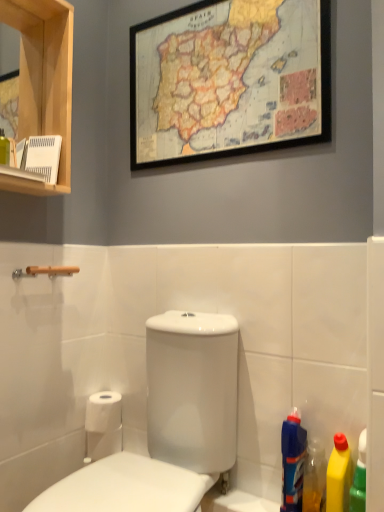
Locate an element on the screen. The image size is (384, 512). white matte toilet paper at lower left is located at coordinates (103, 425).

Image resolution: width=384 pixels, height=512 pixels. Describe the element at coordinates (339, 475) in the screenshot. I see `yellow plastic bottle at lower right, which is counted as the 3th cleaning product, starting from the left` at that location.

What do you see at coordinates (314, 477) in the screenshot? The width and height of the screenshot is (384, 512). I see `translucent plastic bottle at lower right, positioned as the 2th cleaning product in left-to-right order` at bounding box center [314, 477].

Where is `wooden-framed map at upper center`? wooden-framed map at upper center is located at coordinates (229, 80).

From a real-world perspective, is blue plastic bottle at lower right, acting as the 1th cleaning product starting from the left, positioned under yellow plastic bottle at lower right, which is counted as the first cleaning product, starting from the right, based on gravity?

No, from a real-world perspective, blue plastic bottle at lower right, acting as the 1th cleaning product starting from the left, is not under yellow plastic bottle at lower right, which is counted as the first cleaning product, starting from the right.

Is blue plastic bottle at lower right, which ranks as the 3th cleaning product in right-to-left order, far from yellow plastic bottle at lower right, which is counted as the 3th cleaning product, starting from the left?

No, blue plastic bottle at lower right, which ranks as the 3th cleaning product in right-to-left order, is not far away from yellow plastic bottle at lower right, which is counted as the 3th cleaning product, starting from the left.

Is blue plastic bottle at lower right, acting as the 1th cleaning product starting from the left, facing towards yellow plastic bottle at lower right, which is counted as the first cleaning product, starting from the right?

No, blue plastic bottle at lower right, acting as the 1th cleaning product starting from the left, does not turn towards yellow plastic bottle at lower right, which is counted as the first cleaning product, starting from the right.

Would you say blue plastic bottle at lower right, which ranks as the 3th cleaning product in right-to-left order, is inside or outside white glossy toilet at center?

blue plastic bottle at lower right, which ranks as the 3th cleaning product in right-to-left order, is spatially situated outside white glossy toilet at center.

In the scene shown: Considering the sizes of objects blue plastic bottle at lower right, which ranks as the 3th cleaning product in right-to-left order, and white glossy toilet at center in the image provided, who is bigger, blue plastic bottle at lower right, which ranks as the 3th cleaning product in right-to-left order, or white glossy toilet at center?

With larger size is white glossy toilet at center.

From the image's perspective, is blue plastic bottle at lower right, which ranks as the 3th cleaning product in right-to-left order, located above white glossy toilet at center?

No, from the image's perspective, blue plastic bottle at lower right, which ranks as the 3th cleaning product in right-to-left order, is not on top of white glossy toilet at center.

From a real-world perspective, does blue plastic bottle at lower right, acting as the 1th cleaning product starting from the left, sit lower than white glossy toilet at center?

Yes, from a real-world perspective, blue plastic bottle at lower right, acting as the 1th cleaning product starting from the left, is under white glossy toilet at center.

Is yellow plastic bottle at lower right, which is counted as the first cleaning product, starting from the right, shorter than wooden-framed map at upper center?

Correct, yellow plastic bottle at lower right, which is counted as the first cleaning product, starting from the right, is not as tall as wooden-framed map at upper center.

Are yellow plastic bottle at lower right, which is counted as the first cleaning product, starting from the right, and wooden-framed map at upper center making contact?

No, yellow plastic bottle at lower right, which is counted as the first cleaning product, starting from the right, is not in contact with wooden-framed map at upper center.

Consider the image. Is yellow plastic bottle at lower right, which is counted as the 3th cleaning product, starting from the left, not inside wooden-framed map at upper center?

Yes, yellow plastic bottle at lower right, which is counted as the 3th cleaning product, starting from the left, is not within wooden-framed map at upper center.

Is yellow plastic bottle at lower right, which is counted as the 3th cleaning product, starting from the left, looking in the opposite direction of wooden-framed map at upper center?

yellow plastic bottle at lower right, which is counted as the 3th cleaning product, starting from the left, does not have its back to wooden-framed map at upper center.

Considering the positions of objects blue plastic bottle at lower right, acting as the 1th cleaning product starting from the left, and white matte toilet paper at lower left in the image provided, who is behind, blue plastic bottle at lower right, acting as the 1th cleaning product starting from the left, or white matte toilet paper at lower left?

white matte toilet paper at lower left is further away from the camera.

Is blue plastic bottle at lower right, which ranks as the 3th cleaning product in right-to-left order, positioned with its back to white matte toilet paper at lower left?

No, blue plastic bottle at lower right, which ranks as the 3th cleaning product in right-to-left order, is not facing the opposite direction of white matte toilet paper at lower left.

From a real-world perspective, is blue plastic bottle at lower right, acting as the 1th cleaning product starting from the left, physically below white matte toilet paper at lower left?

No.

This screenshot has height=512, width=384. What are the coordinates of `the 3rd cleaning product above when counting from the white matte toilet paper at lower left (from the image's perspective)` in the screenshot? It's located at (292, 462).

Looking at this image, is wooden-framed map at upper center placed right next to white glossy toilet at center?

No, wooden-framed map at upper center is not next to white glossy toilet at center.

Who is smaller, wooden-framed map at upper center or white glossy toilet at center?

With smaller size is wooden-framed map at upper center.

Between point (200, 153) and point (84, 482), which one is positioned behind?

The point (200, 153) is more distant.

From the image's perspective, is white matte toilet paper at lower left above translucent plastic bottle at lower right, positioned as the 2th cleaning product in left-to-right order?

Incorrect, from the image's perspective, white matte toilet paper at lower left is lower than translucent plastic bottle at lower right, positioned as the 2th cleaning product in left-to-right order.

Is white matte toilet paper at lower left wider than translucent plastic bottle at lower right, which appears as the second cleaning product when viewed from the right?

Indeed, white matte toilet paper at lower left has a greater width compared to translucent plastic bottle at lower right, which appears as the second cleaning product when viewed from the right.

Looking at this image, considering the sizes of white matte toilet paper at lower left and translucent plastic bottle at lower right, positioned as the 2th cleaning product in left-to-right order, in the image, is white matte toilet paper at lower left bigger or smaller than translucent plastic bottle at lower right, positioned as the 2th cleaning product in left-to-right order,?

In the image, white matte toilet paper at lower left appears to be larger than translucent plastic bottle at lower right, positioned as the 2th cleaning product in left-to-right order.

Consider the image. Which object is closer to the camera taking this photo, white matte toilet paper at lower left or translucent plastic bottle at lower right, positioned as the 2th cleaning product in left-to-right order?

translucent plastic bottle at lower right, positioned as the 2th cleaning product in left-to-right order, is in front.

Is translucent plastic bottle at lower right, which appears as the second cleaning product when viewed from the right, next to yellow plastic bottle at lower right, which is counted as the first cleaning product, starting from the right?

Yes, translucent plastic bottle at lower right, which appears as the second cleaning product when viewed from the right, is beside yellow plastic bottle at lower right, which is counted as the first cleaning product, starting from the right.

Which is more to the right, translucent plastic bottle at lower right, which appears as the second cleaning product when viewed from the right, or yellow plastic bottle at lower right, which is counted as the 3th cleaning product, starting from the left?

yellow plastic bottle at lower right, which is counted as the 3th cleaning product, starting from the left.

Is yellow plastic bottle at lower right, which is counted as the 3th cleaning product, starting from the left, at the back of translucent plastic bottle at lower right, positioned as the 2th cleaning product in left-to-right order?

No, translucent plastic bottle at lower right, positioned as the 2th cleaning product in left-to-right order, is not facing away from yellow plastic bottle at lower right, which is counted as the 3th cleaning product, starting from the left.

Does translucent plastic bottle at lower right, positioned as the 2th cleaning product in left-to-right order, contain yellow plastic bottle at lower right, which is counted as the 3th cleaning product, starting from the left?

No, translucent plastic bottle at lower right, positioned as the 2th cleaning product in left-to-right order, does not contain yellow plastic bottle at lower right, which is counted as the 3th cleaning product, starting from the left.

Starting from the blue plastic bottle at lower right, which ranks as the 3th cleaning product in right-to-left order, which cleaning product is the 2nd one in front? Please provide its 2D coordinates.

[(339, 475)]

This screenshot has width=384, height=512. Identify the location of the 3rd cleaning product behind the white glossy toilet at center, counting from the anchor's position. (292, 462).

From the picture: Which object lies nearer to the anchor point blue plastic bottle at lower right, which ranks as the 3th cleaning product in right-to-left order, translucent plastic bottle at lower right, positioned as the 2th cleaning product in left-to-right order, or wooden-framed map at upper center?

translucent plastic bottle at lower right, positioned as the 2th cleaning product in left-to-right order, is closer to blue plastic bottle at lower right, which ranks as the 3th cleaning product in right-to-left order.

Based on the photo, from the image, which object appears to be nearer to yellow plastic bottle at lower right, which is counted as the 3th cleaning product, starting from the left, blue plastic bottle at lower right, acting as the 1th cleaning product starting from the left, or white glossy toilet at center?

Among the two, blue plastic bottle at lower right, acting as the 1th cleaning product starting from the left, is located nearer to yellow plastic bottle at lower right, which is counted as the 3th cleaning product, starting from the left.

Considering their positions, is wooden-framed map at upper center positioned closer to white matte toilet paper at lower left than white glossy toilet at center?

The object closer to white matte toilet paper at lower left is white glossy toilet at center.

Looking at the image, which one is located further to translucent plastic bottle at lower right, which appears as the second cleaning product when viewed from the right, white glossy toilet at center or wooden-framed map at upper center?

wooden-framed map at upper center is further to translucent plastic bottle at lower right, which appears as the second cleaning product when viewed from the right.

Considering their positions, is white matte toilet paper at lower left positioned further to white glossy toilet at center than blue plastic bottle at lower right, which ranks as the 3th cleaning product in right-to-left order?

white matte toilet paper at lower left.

Considering their positions, is yellow plastic bottle at lower right, which is counted as the 3th cleaning product, starting from the left, positioned closer to white glossy toilet at center than translucent plastic bottle at lower right, positioned as the 2th cleaning product in left-to-right order?

Among the two, translucent plastic bottle at lower right, positioned as the 2th cleaning product in left-to-right order, is located nearer to white glossy toilet at center.

Based on their spatial positions, is blue plastic bottle at lower right, which ranks as the 3th cleaning product in right-to-left order, or translucent plastic bottle at lower right, which appears as the second cleaning product when viewed from the right, closer to wooden-framed map at upper center?

blue plastic bottle at lower right, which ranks as the 3th cleaning product in right-to-left order, lies closer to wooden-framed map at upper center than the other object.

Which object lies further to the anchor point wooden-framed map at upper center, yellow plastic bottle at lower right, which is counted as the 3th cleaning product, starting from the left, or white matte toilet paper at lower left?

white matte toilet paper at lower left.

The height and width of the screenshot is (512, 384). Find the location of `cleaning product located between blue plastic bottle at lower right, which ranks as the 3th cleaning product in right-to-left order, and yellow plastic bottle at lower right, which is counted as the first cleaning product, starting from the right, in the left-right direction`. cleaning product located between blue plastic bottle at lower right, which ranks as the 3th cleaning product in right-to-left order, and yellow plastic bottle at lower right, which is counted as the first cleaning product, starting from the right, in the left-right direction is located at coordinates (314, 477).

Image resolution: width=384 pixels, height=512 pixels. Identify the location of cleaning product between white glossy toilet at center and translucent plastic bottle at lower right, positioned as the 2th cleaning product in left-to-right order. (292, 462).

Identify the location of toilet between wooden-framed map at upper center and translucent plastic bottle at lower right, positioned as the 2th cleaning product in left-to-right order, from top to bottom. [x=169, y=424].

This screenshot has width=384, height=512. I want to click on toilet between wooden-framed map at upper center and blue plastic bottle at lower right, acting as the 1th cleaning product starting from the left, in the vertical direction, so click(x=169, y=424).